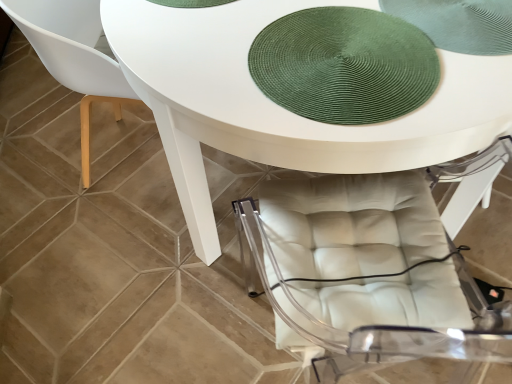
I want to click on empty space that is ontop of green woven mat at upper center (from a real-world perspective), so click(x=347, y=60).